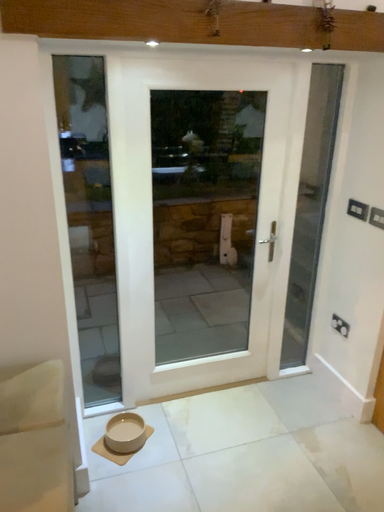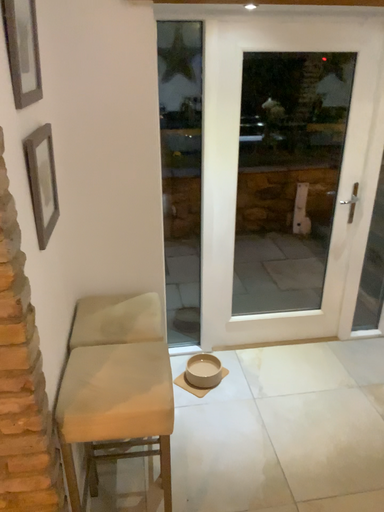
Question: Which way did the camera rotate in the video?

Choices:
 (A) rotated left
 (B) rotated right

Answer: (A)